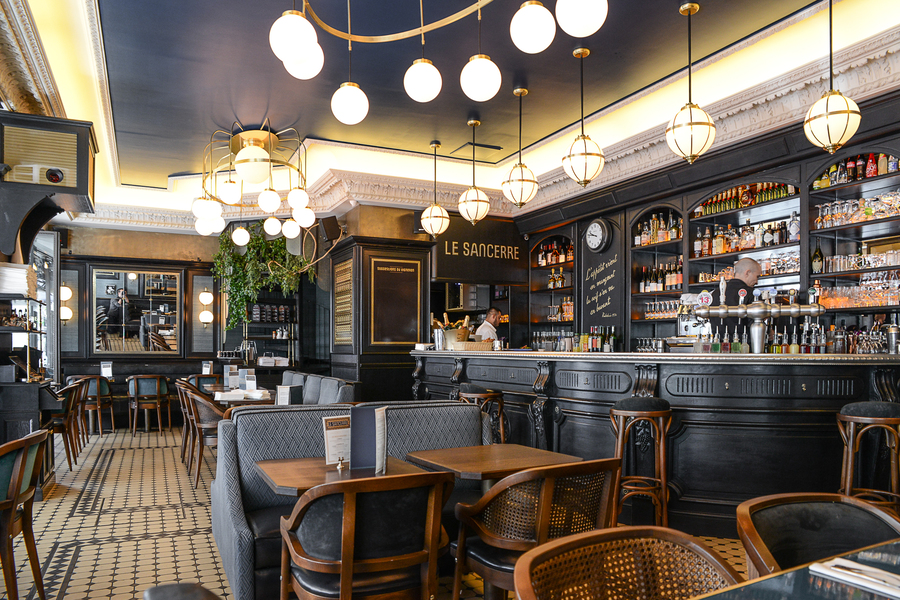
The width and height of the screenshot is (900, 600). In order to click on white wall lights in this screenshot , I will do `click(209, 294)`, `click(204, 316)`, `click(68, 315)`, `click(68, 292)`.